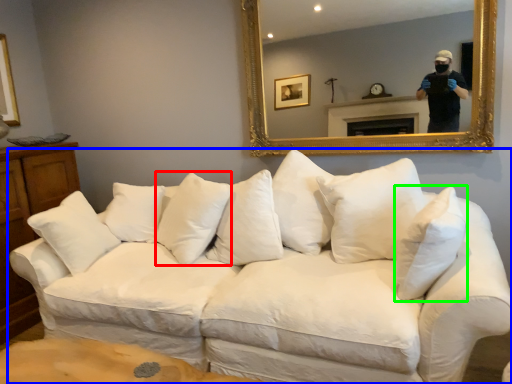
Question: Estimate the real-world distances between objects in this image. Which object is farther from pillow (highlighted by a red box), studio couch (highlighted by a blue box) or pillow (highlighted by a green box)?

Choices:
 (A) studio couch
 (B) pillow

Answer: (B)